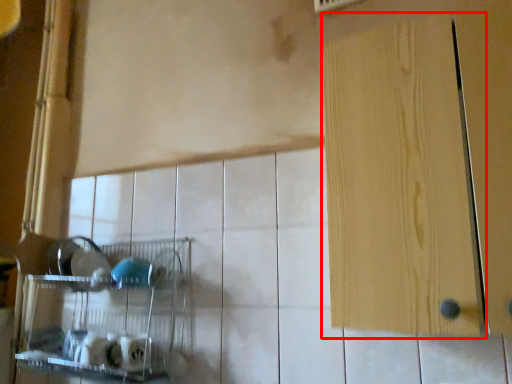
Question: From the image's perspective, where is door (annotated by the red box) located in relation to shelf in the image?

Choices:
 (A) above
 (B) below

Answer: (A)